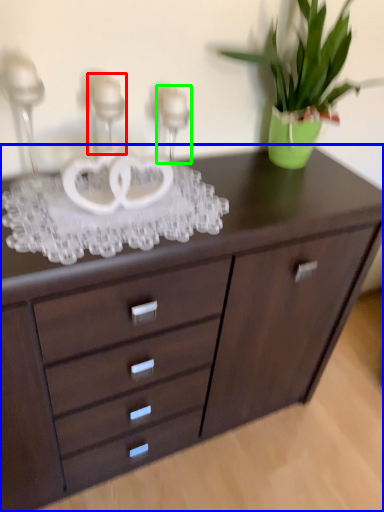
Question: Based on their relative distances, which object is farther from candle holder (highlighted by a red box)? Choose from chest of drawers (highlighted by a blue box) and candle holder (highlighted by a green box).

Choices:
 (A) chest of drawers
 (B) candle holder

Answer: (A)